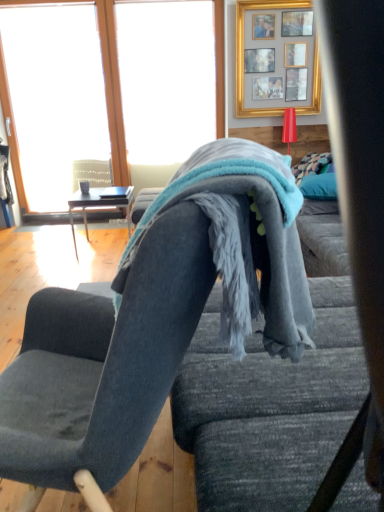
Question: Is gold/glass picture frame at upper center wider or thinner than velvet dark gray chair at center?

Choices:
 (A) wide
 (B) thin

Answer: (B)

Question: In the image, is gold/glass picture frame at upper center positioned in front of or behind velvet dark gray chair at center?

Choices:
 (A) behind
 (B) front

Answer: (A)

Question: Estimate the real-world distances between objects in this image. Which object is closer to the transparent glass window at upper left?

Choices:
 (A) wooden glossy table at left
 (B) gold/glass picture frame at upper center
 (C) soft blue fleece blanket at center
 (D) transparent glass window at upper left
 (E) velvet dark gray chair at center

Answer: (D)

Question: Estimate the real-world distances between objects in this image. Which object is closer to the wooden glossy table at left?

Choices:
 (A) velvet dark gray chair at center
 (B) transparent glass window at upper left
 (C) transparent glass window at upper left
 (D) teal plush pillow at right
 (E) soft blue fleece blanket at center

Answer: (C)